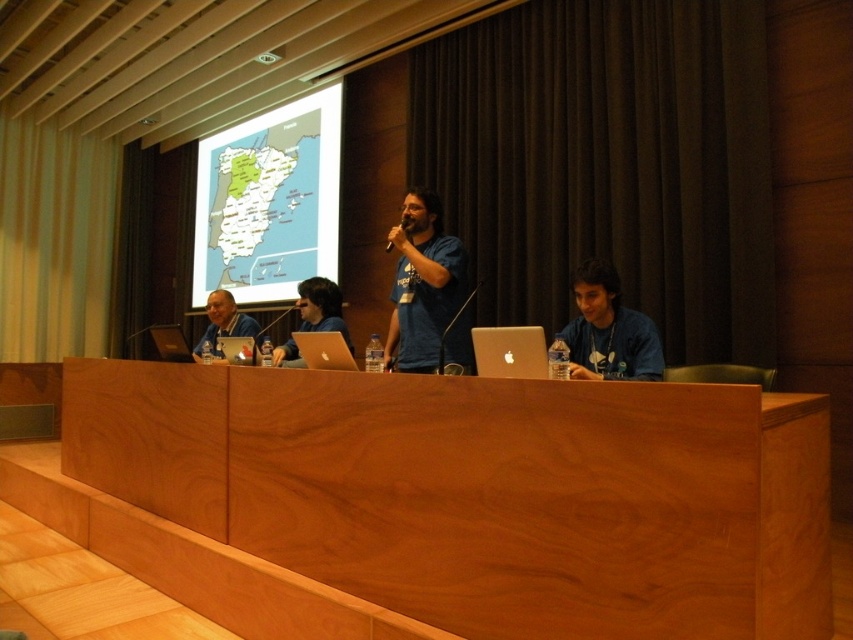
You are an attendee in the conference room. You need to locate the metallic silver laptop at center and the matte map at upper center. Which object is positioned higher up in the image?

The matte map at upper center is positioned higher up in the image than the metallic silver laptop at center because it is much taller as metallic silver laptop at center.

You are an attendee at the presentation and want to locate the map displayed on the screen. Based on the description, where exactly is the matte map at upper center positioned in the image?

The matte map at upper center is positioned at the coordinates point (268, 202) in the image.